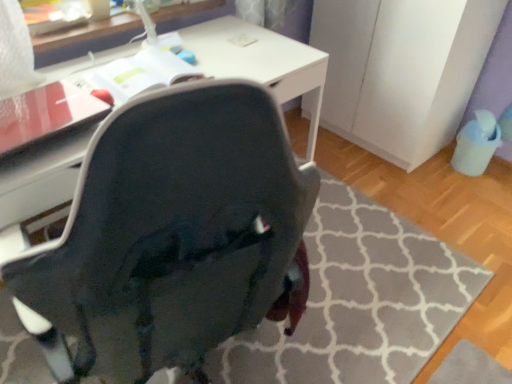
Question: Is matte black chair at center at the right side of white matte file cabinet at right?

Choices:
 (A) no
 (B) yes

Answer: (A)

Question: Are matte black chair at center and white matte file cabinet at right making contact?

Choices:
 (A) yes
 (B) no

Answer: (B)

Question: Is white matte file cabinet at right at the back of matte black chair at center?

Choices:
 (A) no
 (B) yes

Answer: (A)

Question: From the image's perspective, is matte black chair at center over white matte file cabinet at right?

Choices:
 (A) yes
 (B) no

Answer: (B)

Question: Considering the relative positions of matte black chair at center and white matte file cabinet at right in the image provided, is matte black chair at center behind white matte file cabinet at right?

Choices:
 (A) no
 (B) yes

Answer: (A)

Question: In the image, is white glossy table at upper center on the left side or the right side of matte black chair at center?

Choices:
 (A) right
 (B) left

Answer: (B)

Question: Is white glossy table at upper center wider or thinner than matte black chair at center?

Choices:
 (A) thin
 (B) wide

Answer: (A)

Question: Considering the positions of white glossy table at upper center and matte black chair at center in the image, is white glossy table at upper center taller or shorter than matte black chair at center?

Choices:
 (A) short
 (B) tall

Answer: (B)

Question: Based on their sizes in the image, would you say white glossy table at upper center is bigger or smaller than matte black chair at center?

Choices:
 (A) small
 (B) big

Answer: (A)

Question: Is matte black chair at center taller or shorter than white glossy table at upper center?

Choices:
 (A) short
 (B) tall

Answer: (A)

Question: Looking at their shapes, would you say matte black chair at center is wider or thinner than white glossy table at upper center?

Choices:
 (A) wide
 (B) thin

Answer: (A)

Question: Do you think matte black chair at center is within white glossy table at upper center, or outside of it?

Choices:
 (A) outside
 (B) inside

Answer: (A)

Question: Is point (298, 190) closer or farther from the camera than point (64, 56)?

Choices:
 (A) farther
 (B) closer

Answer: (B)

Question: Relative to white matte file cabinet at right, is matte black chair at center in front or behind?

Choices:
 (A) behind
 (B) front

Answer: (B)

Question: From a real-world perspective, relative to white matte file cabinet at right, is matte black chair at center vertically above or below?

Choices:
 (A) above
 (B) below

Answer: (B)